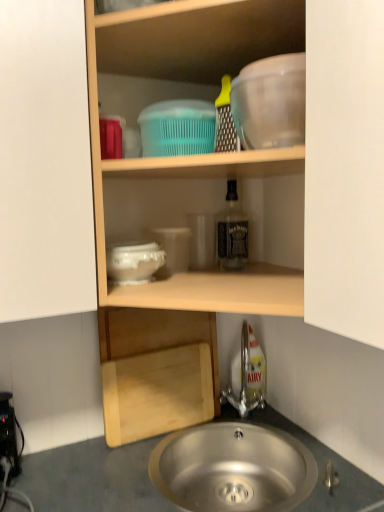
What do you see at coordinates (177, 128) in the screenshot? Image resolution: width=384 pixels, height=512 pixels. I see `teal plastic basin at upper center, the first basin from the top` at bounding box center [177, 128].

Describe the element at coordinates (195, 156) in the screenshot. I see `translucent plastic shelf at upper center` at that location.

Where is `silver metallic tap at lower center`? silver metallic tap at lower center is located at coordinates (247, 377).

Locate an element on the screen. This screenshot has height=512, width=384. clear glass bottle at center is located at coordinates (232, 232).

Where is `teal plastic basin at upper center, the first basin from the top`? teal plastic basin at upper center, the first basin from the top is located at coordinates (177, 128).

Which of these two, white glossy bowl at center, the 1th basin from the bottom, or clear glass bottle at center, is smaller?

white glossy bowl at center, the 1th basin from the bottom, is smaller.

Which is in front, white glossy bowl at center, marked as the second basin in a top-to-bottom arrangement, or clear glass bottle at center?

white glossy bowl at center, marked as the second basin in a top-to-bottom arrangement, is more forward.

Which is correct: white glossy bowl at center, marked as the second basin in a top-to-bottom arrangement, is inside clear glass bottle at center, or outside of it?

white glossy bowl at center, marked as the second basin in a top-to-bottom arrangement, is not inside clear glass bottle at center, it's outside.

Consider the image. Which of these two, white glossy bowl at center, the 1th basin from the bottom, or clear glass bottle at center, is wider?

white glossy bowl at center, the 1th basin from the bottom, is wider.

Would you consider black plastic power strip at lower left to be distant from silver metallic tap at lower center?

black plastic power strip at lower left is near silver metallic tap at lower center, not far away.

Is silver metallic tap at lower center inside black plastic power strip at lower left?

No, black plastic power strip at lower left does not contain silver metallic tap at lower center.

Locate an element on the screen. The width and height of the screenshot is (384, 512). tap positioned vertically above the black plastic power strip at lower left (from a real-world perspective) is located at coordinates (247, 377).

Based on the photo, which of these two, black plastic power strip at lower left or silver metallic tap at lower center, stands taller?

silver metallic tap at lower center.

Is clear glass bottle at center positioned far away from black plastic power strip at lower left?

No, there isn't a large distance between clear glass bottle at center and black plastic power strip at lower left.

Measure the distance between clear glass bottle at center and black plastic power strip at lower left.

They are 31.39 inches apart.

Which object is closer to the camera, clear glass bottle at center or black plastic power strip at lower left?

Positioned in front is black plastic power strip at lower left.

Is clear glass bottle at center looking in the opposite direction of black plastic power strip at lower left?

clear glass bottle at center is not turned away from black plastic power strip at lower left.

Which object is further away from the camera, clear glass bottle at center or stainless steel sink at lower center?

clear glass bottle at center is further away from the camera.

Does clear glass bottle at center have a lesser height compared to stainless steel sink at lower center?

No, clear glass bottle at center is not shorter than stainless steel sink at lower center.

Looking at this image, could you tell me if clear glass bottle at center is turned towards stainless steel sink at lower center?

No.

Considering the relative sizes of clear glass bottle at center and stainless steel sink at lower center in the image provided, is clear glass bottle at center smaller than stainless steel sink at lower center?

Correct, clear glass bottle at center occupies less space than stainless steel sink at lower center.

Where is `tap that appears behind the teal plastic basin at upper center, the 2th basin when ordered from bottom to top`? The width and height of the screenshot is (384, 512). tap that appears behind the teal plastic basin at upper center, the 2th basin when ordered from bottom to top is located at coordinates (247, 377).

From a real-world perspective, is silver metallic tap at lower center located higher than teal plastic basin at upper center, the 2th basin when ordered from bottom to top?

Actually, silver metallic tap at lower center is physically below teal plastic basin at upper center, the 2th basin when ordered from bottom to top, in the real world.

How far apart are silver metallic tap at lower center and teal plastic basin at upper center, the 2th basin when ordered from bottom to top?

silver metallic tap at lower center is 29.71 inches away from teal plastic basin at upper center, the 2th basin when ordered from bottom to top.

Is silver metallic tap at lower center positioned in front of teal plastic basin at upper center, the 2th basin when ordered from bottom to top?

No, silver metallic tap at lower center is further to the viewer.

Where is `shelf above the stainless steel sink at lower center (from a real-world perspective)`? This screenshot has height=512, width=384. shelf above the stainless steel sink at lower center (from a real-world perspective) is located at coordinates 195,156.

Is the position of translucent plastic shelf at upper center less distant than that of stainless steel sink at lower center?

Yes, the depth of translucent plastic shelf at upper center is less than that of stainless steel sink at lower center.

Is translucent plastic shelf at upper center taller or shorter than stainless steel sink at lower center?

Considering their sizes, translucent plastic shelf at upper center has more height than stainless steel sink at lower center.

What's the angular difference between translucent plastic shelf at upper center and stainless steel sink at lower center's facing directions?

They differ by 5.5 degrees in their facing directions.

Which is behind, teal plastic basin at upper center, the first basin from the top, or white glossy bowl at center, marked as the second basin in a top-to-bottom arrangement?

teal plastic basin at upper center, the first basin from the top, is further away from the camera.

Between teal plastic basin at upper center, the 2th basin when ordered from bottom to top, and white glossy bowl at center, marked as the second basin in a top-to-bottom arrangement, which one has less height?

Standing shorter between the two is white glossy bowl at center, marked as the second basin in a top-to-bottom arrangement.

Is teal plastic basin at upper center, the first basin from the top, to the left or to the right of white glossy bowl at center, the 1th basin from the bottom, in the image?

In the image, teal plastic basin at upper center, the first basin from the top, appears on the right side of white glossy bowl at center, the 1th basin from the bottom.

Consider the image. Considering the relative sizes of teal plastic basin at upper center, the 2th basin when ordered from bottom to top, and white glossy bowl at center, marked as the second basin in a top-to-bottom arrangement, in the image provided, is teal plastic basin at upper center, the 2th basin when ordered from bottom to top, smaller than white glossy bowl at center, marked as the second basin in a top-to-bottom arrangement,?

Actually, teal plastic basin at upper center, the 2th basin when ordered from bottom to top, might be larger than white glossy bowl at center, marked as the second basin in a top-to-bottom arrangement.

Locate an element on the screen. bottle behind the white glossy bowl at center, marked as the second basin in a top-to-bottom arrangement is located at coordinates (232, 232).

The height and width of the screenshot is (512, 384). In order to click on appliance on the left of silver metallic tap at lower center in this screenshot , I will do `click(8, 433)`.

Considering their positions, is translucent plastic shelf at upper center positioned further to white glossy bowl at center, marked as the second basin in a top-to-bottom arrangement, than smooth gray countertop at lower center?

smooth gray countertop at lower center.

Estimate the real-world distances between objects in this image. Which object is closer to silver metallic tap at lower center, black plastic power strip at lower left or smooth gray countertop at lower center?

Based on the image, smooth gray countertop at lower center appears to be nearer to silver metallic tap at lower center.

Looking at the image, which one is located further to smooth gray countertop at lower center, white glossy bowl at center, the 1th basin from the bottom, or clear glass bottle at center?

Among the two, clear glass bottle at center is located further to smooth gray countertop at lower center.

From the image, which object appears to be farther from translucent plastic shelf at upper center, black plastic power strip at lower left or teal plastic basin at upper center, the 2th basin when ordered from bottom to top?

Based on the image, black plastic power strip at lower left appears to be further to translucent plastic shelf at upper center.

Based on their spatial positions, is transparent plastic mixing bowl at upper right or teal plastic basin at upper center, the first basin from the top, closer to stainless steel sink at lower center?

teal plastic basin at upper center, the first basin from the top, is closer to stainless steel sink at lower center.

From the image, which object appears to be nearer to translucent plastic shelf at upper center, black plastic power strip at lower left or transparent plastic mixing bowl at upper right?

Among the two, transparent plastic mixing bowl at upper right is located nearer to translucent plastic shelf at upper center.

Based on their spatial positions, is black plastic power strip at lower left or silver metallic tap at lower center closer to white glossy bowl at center, the 1th basin from the bottom?

black plastic power strip at lower left is closer to white glossy bowl at center, the 1th basin from the bottom.

Which object lies further to the anchor point smooth gray countertop at lower center, white glossy bowl at center, marked as the second basin in a top-to-bottom arrangement, or black plastic power strip at lower left?

Based on the image, white glossy bowl at center, marked as the second basin in a top-to-bottom arrangement, appears to be further to smooth gray countertop at lower center.

At what (x,y) coordinates should I click in order to perform the action: click on mixing bowl that lies between translucent plastic shelf at upper center and silver metallic tap at lower center from top to bottom. Please return your answer as a coordinate pair (x, y). The width and height of the screenshot is (384, 512). Looking at the image, I should click on (270, 102).

At what (x,y) coordinates should I click in order to perform the action: click on tap between white glossy bowl at center, marked as the second basin in a top-to-bottom arrangement, and stainless steel sink at lower center from top to bottom. Please return your answer as a coordinate pair (x, y). Looking at the image, I should click on (247, 377).

Find the location of `tap between transparent plastic mixing bowl at upper right and stainless steel sink at lower center vertically`. tap between transparent plastic mixing bowl at upper right and stainless steel sink at lower center vertically is located at coordinates (247, 377).

The width and height of the screenshot is (384, 512). I want to click on tap that lies between transparent plastic mixing bowl at upper right and smooth gray countertop at lower center from top to bottom, so click(x=247, y=377).